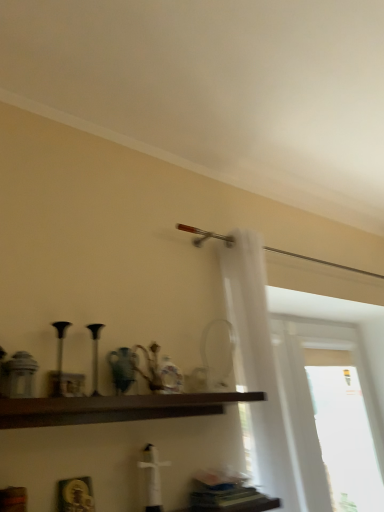
Question: From a real-world perspective, relative to transparent glass window at right, is dark brown wood shelf at center vertically above or below?

Choices:
 (A) below
 (B) above

Answer: (B)

Question: Choose the correct answer: Is dark brown wood shelf at center inside transparent glass window at right or outside it?

Choices:
 (A) outside
 (B) inside

Answer: (A)

Question: Based on their relative distances, which object is nearer to the white sheer curtain at right?

Choices:
 (A) transparent glass window at right
 (B) dark brown wood shelf at center

Answer: (B)

Question: Which object is the closest to the dark brown wood shelf at center?

Choices:
 (A) white sheer curtain at right
 (B) transparent glass window at right

Answer: (A)